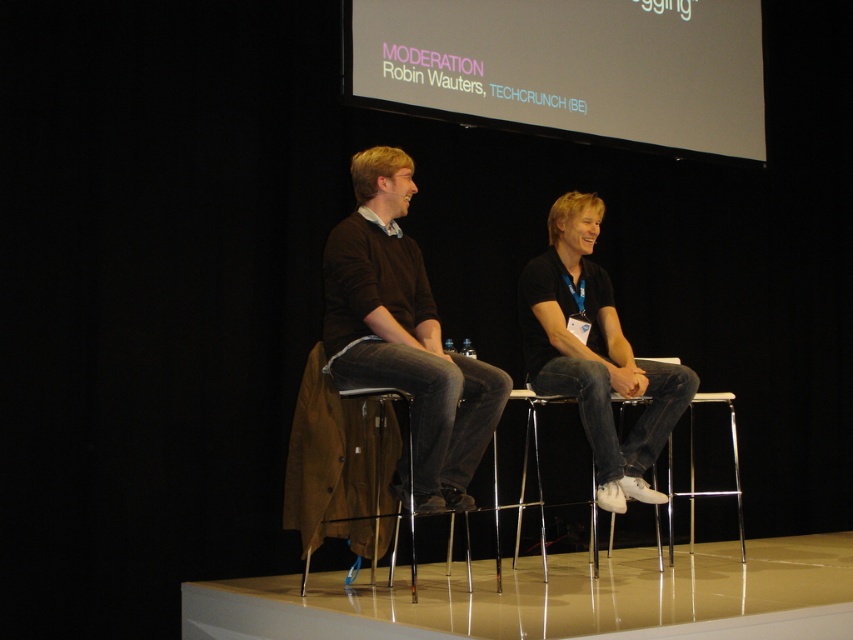
Is point (683, 108) farther from camera compared to point (639, 449)?

Yes, point (683, 108) is behind point (639, 449).

Looking at this image, is white matte projection screen at upper center to the left of black matte shirt at center from the viewer's perspective?

Incorrect, white matte projection screen at upper center is not on the left side of black matte shirt at center.

Describe the element at coordinates (569, 68) in the screenshot. Image resolution: width=853 pixels, height=640 pixels. I see `white matte projection screen at upper center` at that location.

Find the location of a particular element. Image resolution: width=853 pixels, height=640 pixels. white matte projection screen at upper center is located at coordinates (569, 68).

Can you confirm if matte brown sweater at center is taller than black matte shirt at center?

Yes, matte brown sweater at center is taller than black matte shirt at center.

Is point (376, 291) positioned before point (595, 424)?

Yes.

Is point (486, 385) in front of point (572, 248)?

Yes.

This screenshot has width=853, height=640. What are the coordinates of `matte brown sweater at center` in the screenshot? It's located at (404, 333).

Can you confirm if white matte projection screen at upper center is positioned to the right of matte brown sweater at center?

Yes, white matte projection screen at upper center is to the right of matte brown sweater at center.

Who is more distant from viewer, (608, 13) or (334, 330)?

The point (608, 13) is behind.

Is point (425, 72) positioned in front of point (374, 289)?

No, it is not.

At what (x,y) coordinates should I click in order to perform the action: click on white matte projection screen at upper center. Please return your answer as a coordinate pair (x, y). This screenshot has width=853, height=640. Looking at the image, I should click on (569, 68).